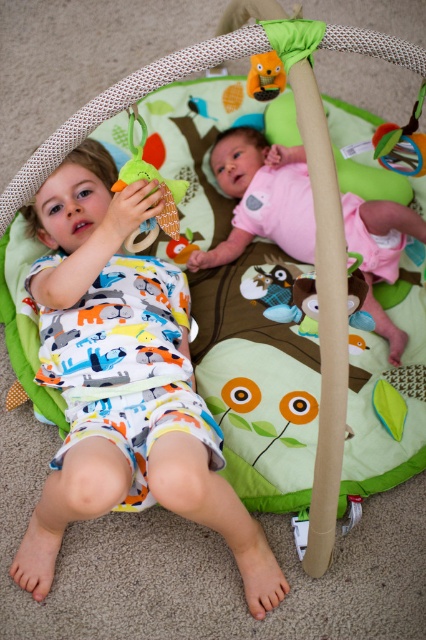
Is rubber teething ring at upper right closer to camera compared to matte orange plush toy at upper center?

Yes, rubber teething ring at upper right is closer to the viewer.

Is rubber teething ring at upper right thinner than matte orange plush toy at upper center?

In fact, rubber teething ring at upper right might be wider than matte orange plush toy at upper center.

Which is in front, point (374, 156) or point (252, 76)?

Point (374, 156) is more forward.

Locate an element on the screen. rubber teething ring at upper right is located at coordinates (402, 141).

Who is lower down, pink fabric baby at center or soft plush toy at left?

pink fabric baby at center

Is point (268, 157) positioned behind point (114, 189)?

Yes, it is.

Where is `pink fabric baby at center`? pink fabric baby at center is located at coordinates (261, 196).

Consider the image. Is white cotton pajamas at left taller than pink fabric baby at center?

Yes, white cotton pajamas at left is taller than pink fabric baby at center.

Is white cotton pajamas at left bigger than pink fabric baby at center?

Yes.

Between point (98, 198) and point (302, 188), which one is positioned in front?

Point (98, 198) is more forward.

Find the location of a particular element. white cotton pajamas at left is located at coordinates (123, 378).